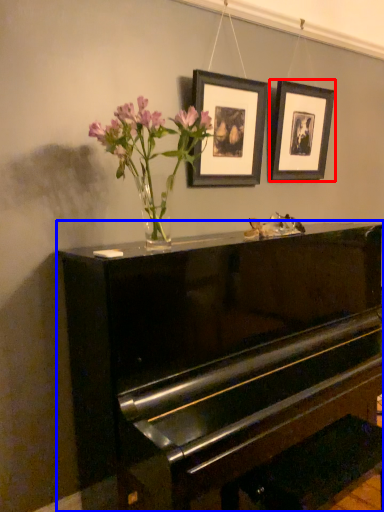
Question: Which of the following is the farthest to the observer, picture frame (highlighted by a red box) or piano (highlighted by a blue box)?

Choices:
 (A) picture frame
 (B) piano

Answer: (A)